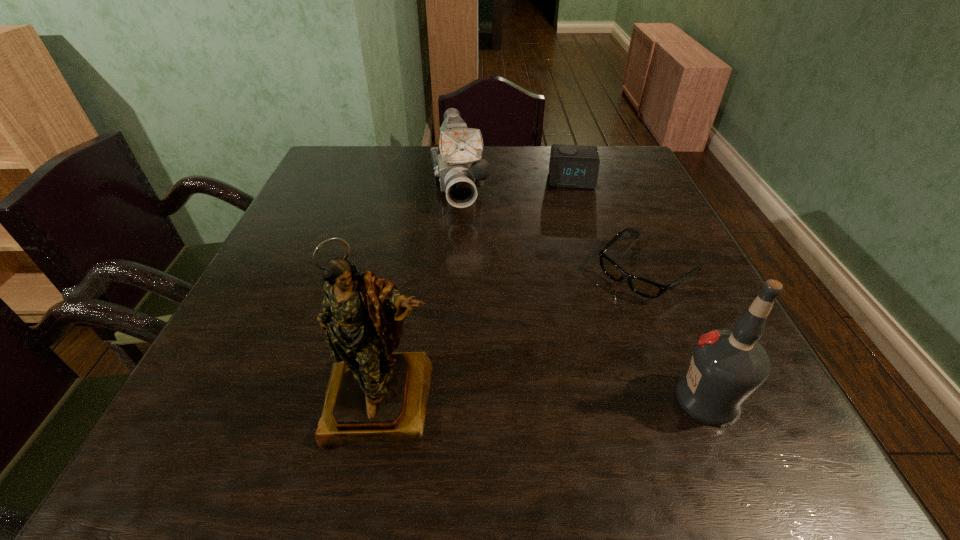
This screenshot has height=540, width=960. Find the location of `vacant region between the alarm clock and the camcorder`. vacant region between the alarm clock and the camcorder is located at coordinates (516, 182).

At what (x,y) coordinates should I click in order to perform the action: click on vacant area that lies between the alarm clock and the third nearest object. Please return your answer as a coordinate pair (x, y). This screenshot has height=540, width=960. Looking at the image, I should click on (611, 224).

Choose which object is the fourth nearest neighbor to the third nearest object. Please provide its 2D coordinates. Your answer should be formatted as a tuple, i.e. [(x, y)], where the tuple contains the x and y coordinates of a point satisfying the conditions above.

[(373, 394)]

Select which object is the fourth closest to the alarm clock. Please provide its 2D coordinates. Your answer should be formatted as a tuple, i.e. [(x, y)], where the tuple contains the x and y coordinates of a point satisfying the conditions above.

[(373, 394)]

Find the location of a particular element. vacant space that satisfies the following two spatial constraints: 1. on the front side of the spectacles; 2. on the front label of the fourth shortest object is located at coordinates (706, 399).

Find the location of a particular element. vacant region that satisfies the following two spatial constraints: 1. on the front side of the shortest object; 2. on the right side of the second shortest object is located at coordinates point(599,268).